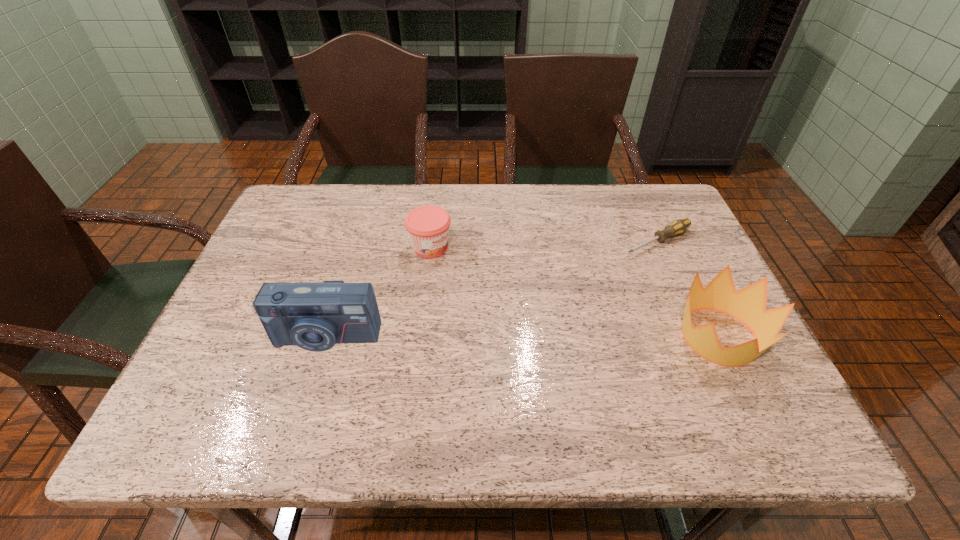
At what (x,y) coordinates should I click in order to perform the action: click on free space that is in between the shortest object and the third tallest object. Please return your answer as a coordinate pair (x, y). This screenshot has width=960, height=540. Looking at the image, I should click on (544, 244).

This screenshot has width=960, height=540. What are the coordinates of `vacant point located between the second object from left to right and the leftmost object` in the screenshot? It's located at (378, 292).

Locate an element on the screen. free space that is in between the camera and the shortest object is located at coordinates (492, 289).

Locate an element on the screen. This screenshot has width=960, height=540. free point between the shortest object and the crown is located at coordinates (688, 289).

What are the coordinates of `vacant area that lies between the screwdriver and the camera` in the screenshot? It's located at (492, 289).

Identify the location of vacant space in between the leftmost object and the crown. (522, 337).

The width and height of the screenshot is (960, 540). I want to click on vacant point located between the jam and the leftmost object, so click(378, 292).

Identify which object is located as the third nearest to the crown. Please provide its 2D coordinates. Your answer should be formatted as a tuple, i.e. [(x, y)], where the tuple contains the x and y coordinates of a point satisfying the conditions above.

[(314, 316)]

Choose which object is the third nearest neighbor to the camera. Please provide its 2D coordinates. Your answer should be formatted as a tuple, i.e. [(x, y)], where the tuple contains the x and y coordinates of a point satisfying the conditions above.

[(748, 305)]

Locate an element on the screen. This screenshot has width=960, height=540. vacant area in the image that satisfies the following two spatial constraints: 1. on the lens of the crown; 2. on the right side of the leftmost object is located at coordinates coord(325,337).